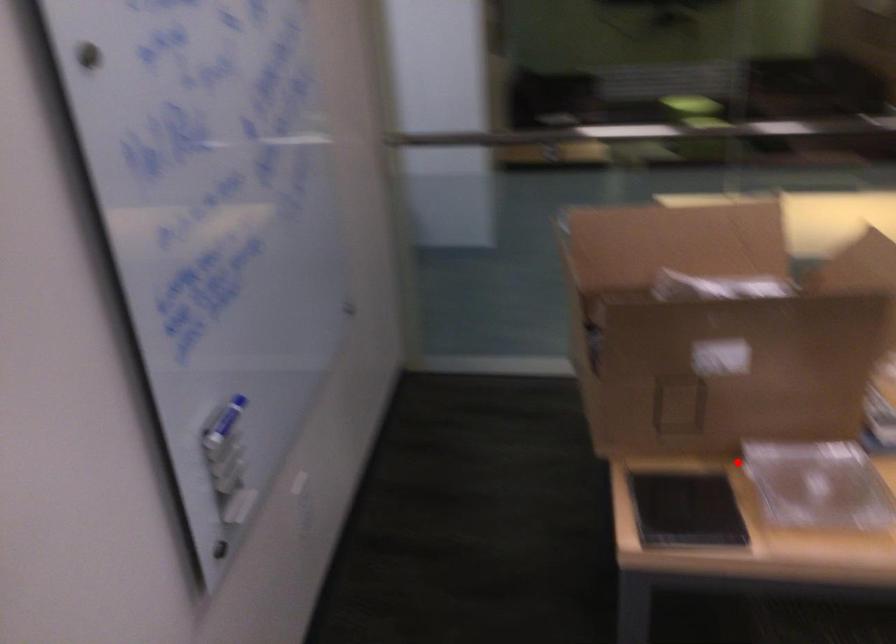
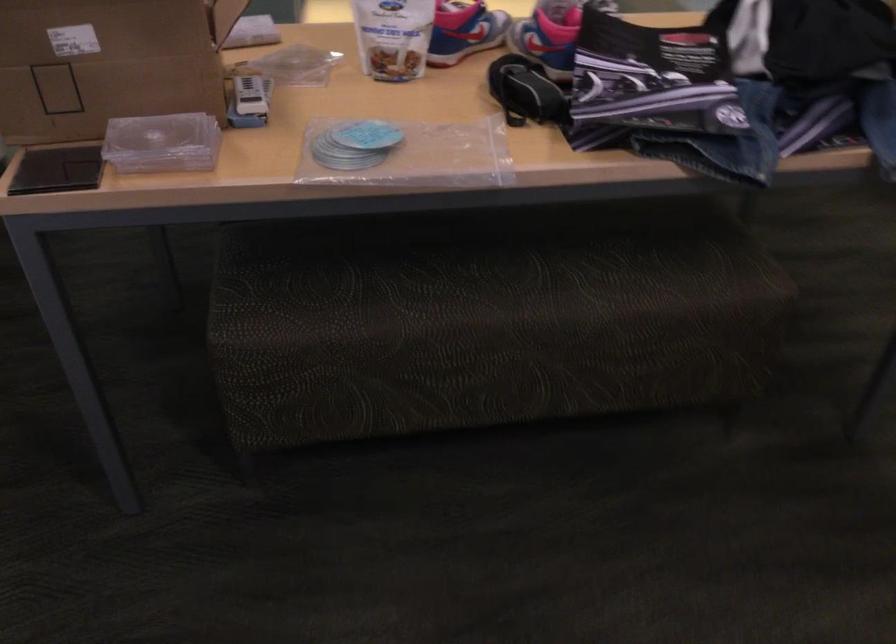
The point at the highlighted location is marked in the first image. Where is the corresponding point in the second image?

(149, 134)